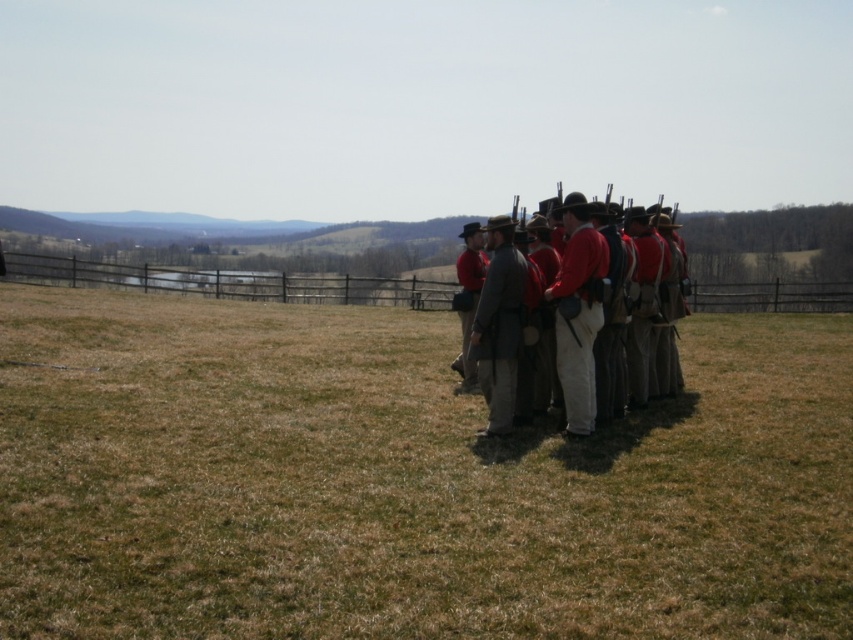
Question: Estimate the real-world distances between objects in this image. Which object is farther from the gray wool coat at center?

Choices:
 (A) red woolen coat at center
 (B) brown dry grass at center

Answer: (B)

Question: From the image, what is the correct spatial relationship of red woolen coat at center in relation to gray wool coat at center?

Choices:
 (A) right
 (B) left

Answer: (A)

Question: Is matte red coat at center thinner than gray wool coat at center?

Choices:
 (A) no
 (B) yes

Answer: (A)

Question: Does matte red coat at center have a lesser width compared to gray wool coat at center?

Choices:
 (A) yes
 (B) no

Answer: (B)

Question: Which object is positioned closest to the red woolen coat at center?

Choices:
 (A) gray wool coat at center
 (B) matte red coat at center

Answer: (B)

Question: Which of the following is the farthest from the observer?

Choices:
 (A) (503, 310)
 (B) (502, 221)
 (C) (573, 376)
 (D) (788, 552)

Answer: (B)